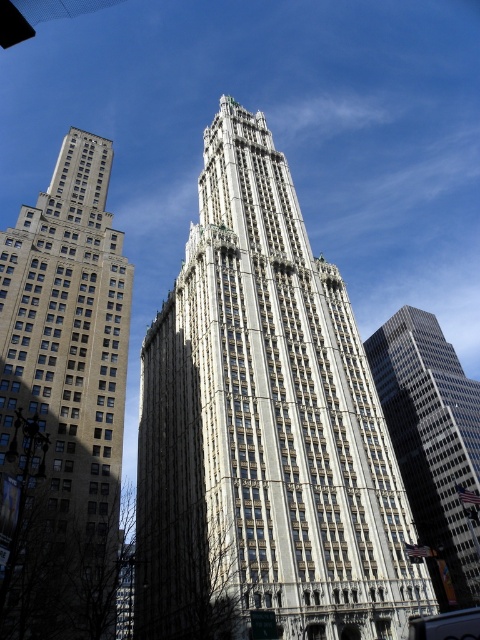
You are an architect reviewing a cityscape design. You notice the white stone skyscraper at center and the beige stone building at left. Which structure would cast a longer shadow during midday? Please base your answer on their relative sizes as depicted in the image.

The white stone skyscraper at center is larger in size than the beige stone building at left, so it would cast a longer shadow during midday.

You are an architect analyzing the urban skyline. You observe the white stone skyscraper at center and the glassy reflective skyscraper at right. Which of these two buildings has a larger physical size?

The white stone skyscraper at center is bigger than the glassy reflective skyscraper at right, so it has a larger physical size.